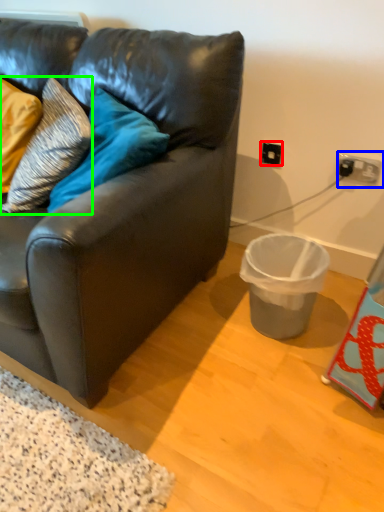
Question: Considering the real-world distances, which object is farthest from electric outlet (highlighted by a red box)? power outlet (highlighted by a blue box) or pillow (highlighted by a green box)?

Choices:
 (A) power outlet
 (B) pillow

Answer: (B)